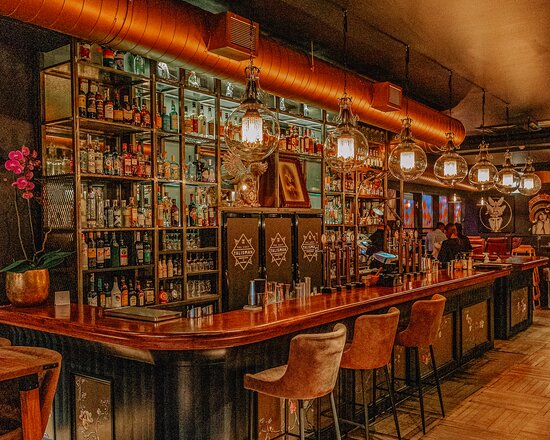
Find the location of `hanging area of lights`. hanging area of lights is located at coordinates [255, 73], [343, 104], [406, 121], [451, 135], [484, 145], [508, 154], [530, 156].